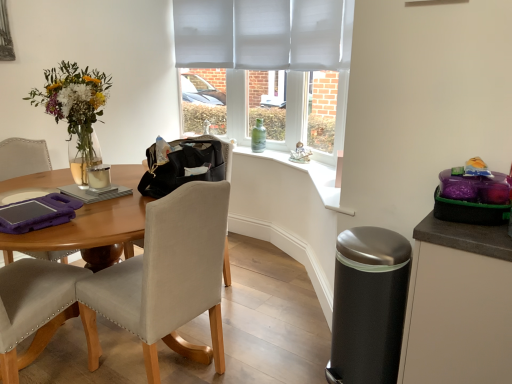
You are a GUI agent. You are given a task and a screenshot of the screen. Output one action in this format:
    pyautogui.click(x=<x>, y=<y>)
    Task: Click on the vacant area that is situated to the right of beige fabric chair at left
    
    Given the screenshot: What is the action you would take?
    pyautogui.click(x=266, y=352)